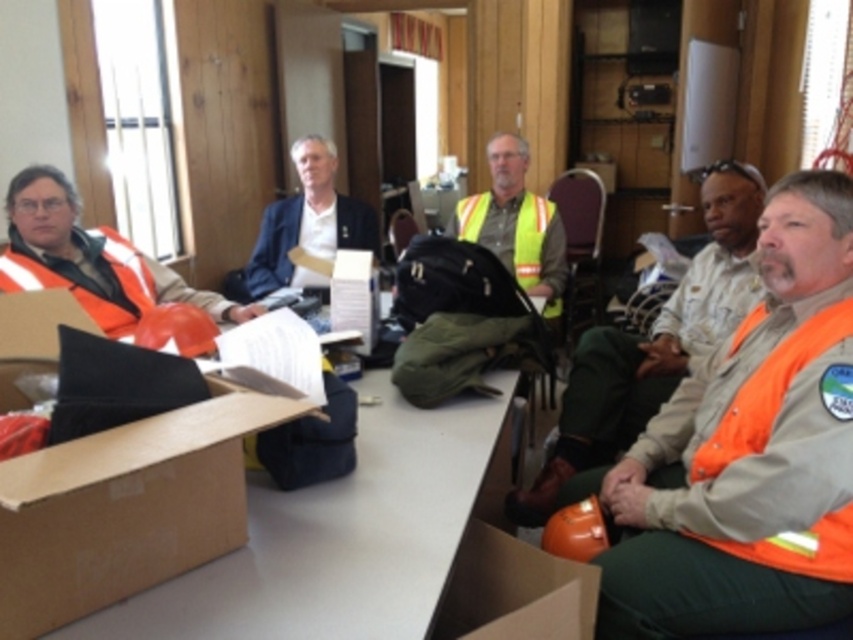
Question: Does orange reflective vest at right come behind matte blue jacket at center?

Choices:
 (A) no
 (B) yes

Answer: (A)

Question: Which object is positioned closest to the brown cardboard box at left?

Choices:
 (A) orange reflective vest at right
 (B) orange reflective vest at left
 (C) matte blue jacket at center

Answer: (B)

Question: Does brown cardboard box at left appear under orange reflective vest at left?

Choices:
 (A) no
 (B) yes

Answer: (B)

Question: Which point appears farthest from the camera in this image?

Choices:
 (A) [x=82, y=304]
 (B) [x=59, y=584]

Answer: (A)

Question: From the image, what is the correct spatial relationship of brown cardboard box at left in relation to matte blue jacket at center?

Choices:
 (A) below
 (B) above

Answer: (A)

Question: Based on their relative distances, which object is nearer to the matte blue jacket at center?

Choices:
 (A) orange reflective vest at left
 (B) brown cardboard box at left

Answer: (A)